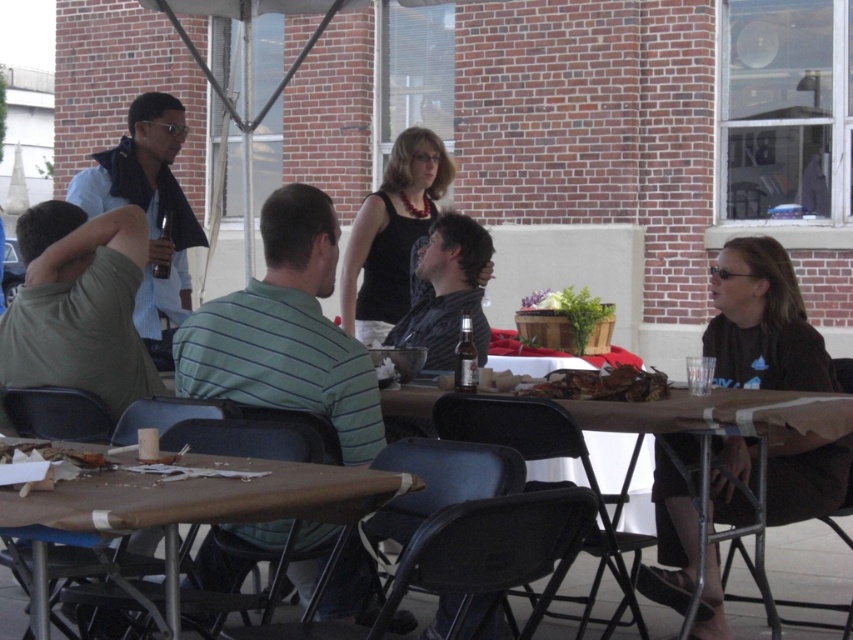
Question: Where is green striped shirt at center located in relation to brown fabric shirt at right in the image?

Choices:
 (A) right
 (B) left

Answer: (B)

Question: Can you confirm if green striped shirt at center is positioned below brown fabric shirt at right?

Choices:
 (A) no
 (B) yes

Answer: (A)

Question: Based on their relative distances, which object is farther from the dark gray shirt at center?

Choices:
 (A) brown fabric shirt at right
 (B) shiny metallic crab at center
 (C) brown paper table at lower left
 (D) green striped shirt at center

Answer: (C)

Question: Which point is closer to the camera taking this photo?

Choices:
 (A) (30, 476)
 (B) (393, 244)
 (C) (39, 611)

Answer: (A)

Question: Is brown paper table at lower center positioned before dark gray shirt at center?

Choices:
 (A) yes
 (B) no

Answer: (A)

Question: Among these points, which one is nearest to the camera?

Choices:
 (A) (180, 280)
 (B) (49, 468)

Answer: (B)